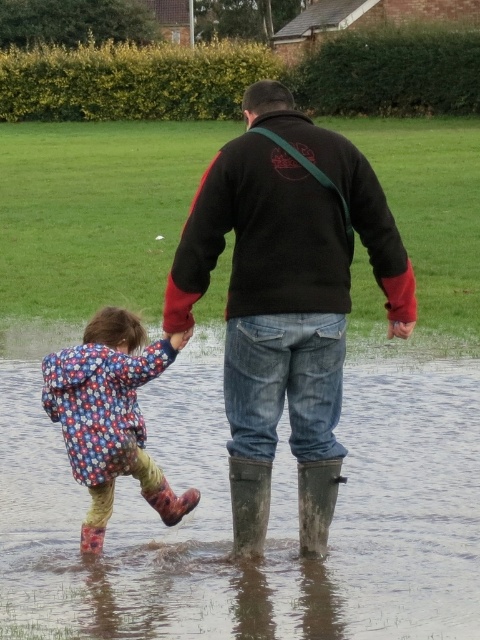
Question: Which point appears closest to the camera in this image?

Choices:
 (A) (158, 410)
 (B) (268, 248)

Answer: (B)

Question: Can you confirm if dark brown leather jacket at center is thinner than rubber/muddy boot at lower center?

Choices:
 (A) no
 (B) yes

Answer: (A)

Question: Which object appears closest to the camera in this image?

Choices:
 (A) black fleece sweatshirt at center
 (B) dark brown leather jacket at center
 (C) rubber/muddy boot at lower center
 (D) muddy rubber boot at lower center

Answer: (B)

Question: Which object is the farthest from the floral-patterned rubber boots at lower left?

Choices:
 (A) black fleece sweatshirt at center
 (B) muddy rubber boots at lower center

Answer: (B)

Question: Does rubber/muddy boot at lower center appear on the right side of muddy rubber boot at lower center?

Choices:
 (A) yes
 (B) no

Answer: (B)

Question: Is muddy rubber boots at lower center smaller than black fleece sweatshirt at center?

Choices:
 (A) yes
 (B) no

Answer: (B)